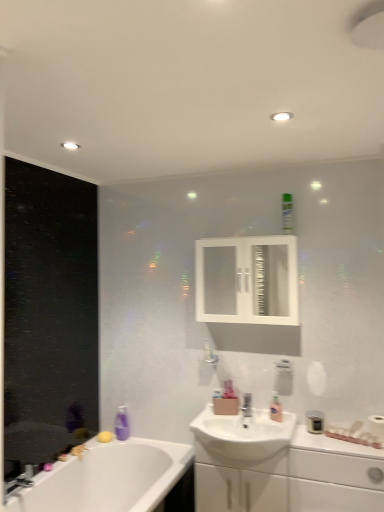
Question: From a real-world perspective, relative to white glossy cabinet at lower right, is white glossy medicine cabinet at upper center vertically above or below?

Choices:
 (A) above
 (B) below

Answer: (A)

Question: In terms of height, does white glossy medicine cabinet at upper center look taller or shorter compared to white glossy cabinet at lower right?

Choices:
 (A) tall
 (B) short

Answer: (B)

Question: Estimate the real-world distances between objects in this image. Which object is farther from the satin nickel faucet at sink center, acting as the second tap starting from the bottom?

Choices:
 (A) matte black canister at lower right, placed as the third toiletry when sorted from left to right
 (B) white glossy cabinet at lower right
 (C) white glossy bathtub at lower left
 (D) green matte bottle at upper center, marked as the third toiletry in a bottom-to-top arrangement
 (E) pink glossy lotion at sink, marked as the 2th toiletry in a bottom-to-top arrangement

Answer: (D)

Question: Which object is the farthest from the green matte bottle at upper center, placed as the second toiletry when sorted from left to right?

Choices:
 (A) white matte toilet paper at right
 (B) white glossy bathtub at lower left
 (C) white glossy sink at center
 (D) white glossy medicine cabinet at upper center
 (E) chrome metallic faucet at lower left, the second tap viewed from the right

Answer: (E)